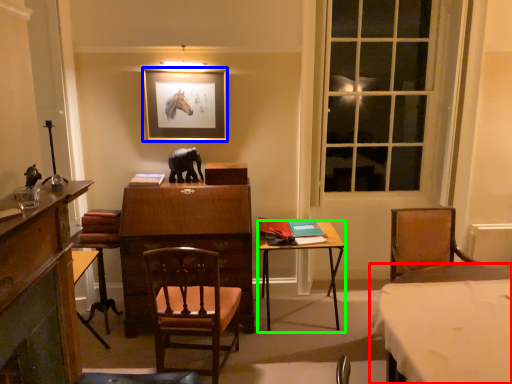
Question: Which object is positioned farthest from table (highlighted by a red box)? Select from picture frame (highlighted by a blue box) and table (highlighted by a green box).

Choices:
 (A) picture frame
 (B) table

Answer: (A)